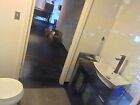
Locate an element on the screen. This screenshot has width=140, height=105. right cabinet door is located at coordinates (87, 92).